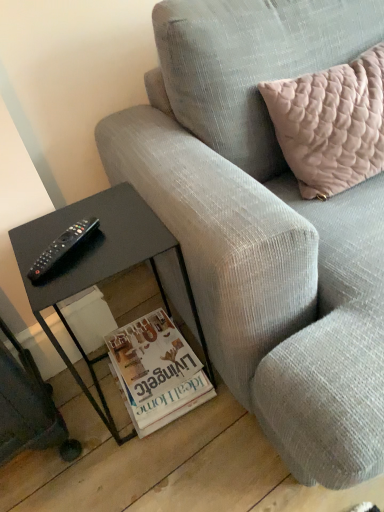
Question: Relative to pale pink quilted cushion at upper right, is black plastic remote at left in front or behind?

Choices:
 (A) behind
 (B) front

Answer: (A)

Question: From a real-world perspective, relative to pale pink quilted cushion at upper right, is black plastic remote at left vertically above or below?

Choices:
 (A) below
 (B) above

Answer: (B)

Question: Considering the real-world distances, which object is farthest from the white glossy magazine at lower center?

Choices:
 (A) black glass table at lower left
 (B) gray corduroy couch at center
 (C) black plastic remote at left
 (D) pale pink quilted cushion at upper right

Answer: (D)

Question: Estimate the real-world distances between objects in this image. Which object is closer to the black glass table at lower left?

Choices:
 (A) white glossy magazine at lower center
 (B) black plastic remote at left
 (C) pale pink quilted cushion at upper right
 (D) gray corduroy couch at center

Answer: (B)